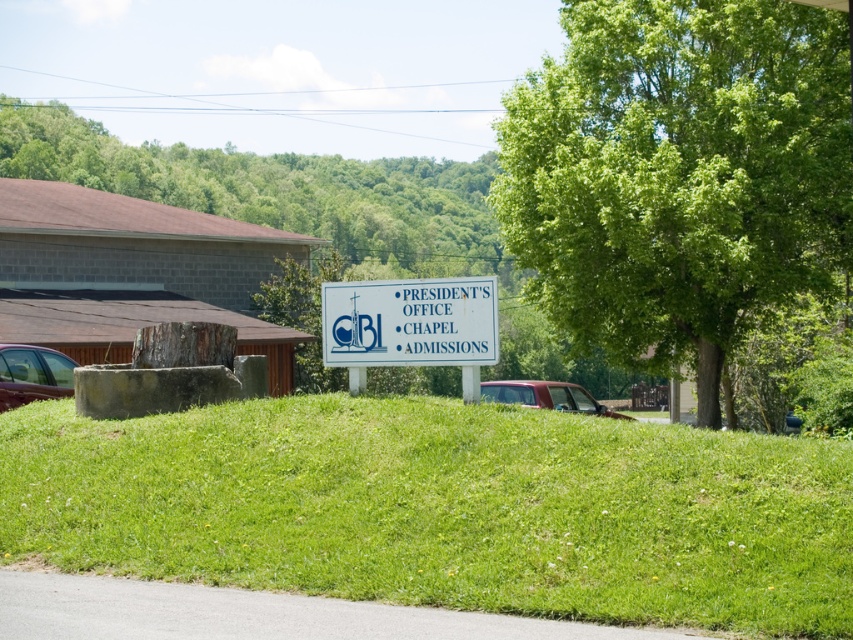
Question: Does green grassy hill at center have a greater width compared to white plastic sign at center?

Choices:
 (A) no
 (B) yes

Answer: (A)

Question: Can you confirm if matte black car at lower left is thinner than metallic red truck at center?

Choices:
 (A) no
 (B) yes

Answer: (B)

Question: Which is nearer to the matte black car at lower left?

Choices:
 (A) green leafy tree at center
 (B) white plastic sign at center

Answer: (B)

Question: Which of the following is the farthest from the observer?

Choices:
 (A) metallic red truck at center
 (B) white plastic sign at center
 (C) green leafy tree at center

Answer: (C)

Question: Based on their relative distances, which object is nearer to the green leafy tree at center?

Choices:
 (A) metallic red truck at center
 (B) green grassy hill at center
 (C) matte black car at lower left

Answer: (A)

Question: Does matte black car at lower left have a greater width compared to metallic red truck at center?

Choices:
 (A) no
 (B) yes

Answer: (A)